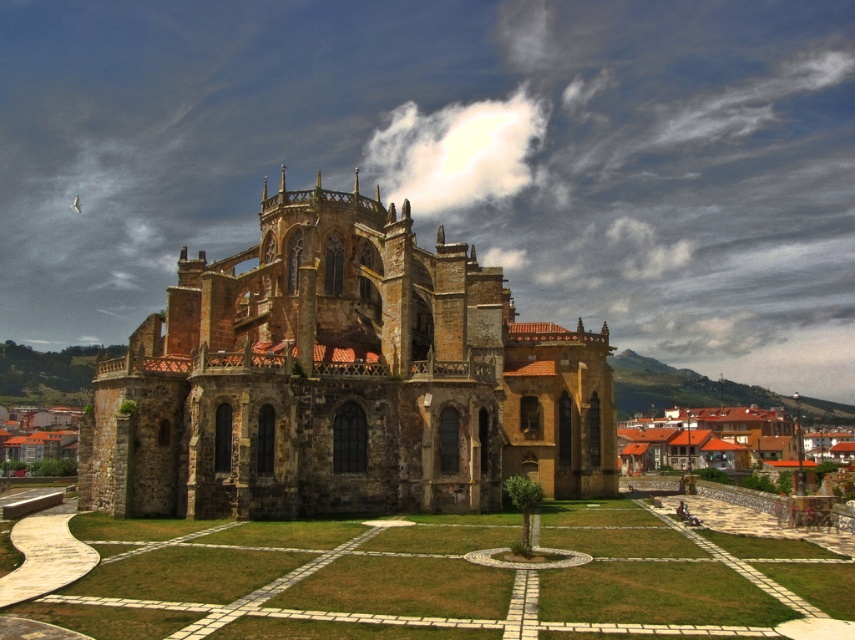
Consider the image. You are standing in front of the cathedral and want to take a photo that includes both the brown wooden houses at lower right and the brown stone buildings at lower left. Which of these two objects is closer to you?

The brown wooden houses at lower right are closer to you than the brown stone buildings at lower left.

You are standing in the grassy area with the white tiles. You want to walk to the brown stone church at center. Which direction should you walk relative to the brown stone buildings at lower left?

You should walk to the right of the brown stone buildings at lower left to reach the brown stone church at center, since the brown stone church at center is located to the right of the brown stone buildings at lower left.